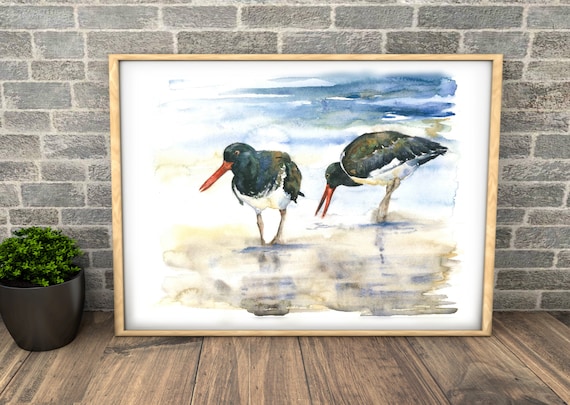
Locate an element on the screen. This screenshot has width=570, height=405. picture on floor leaning against wall is located at coordinates (128, 220).